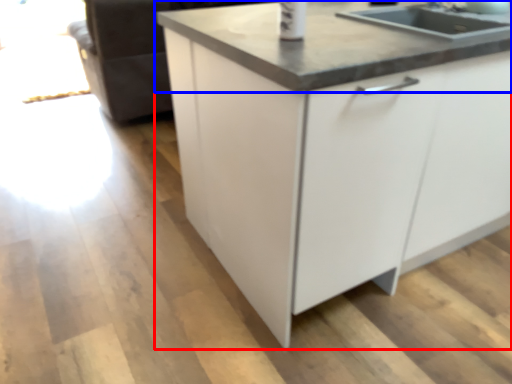
Question: Among these objects, which one is farthest to the camera, cabinetry (highlighted by a red box) or countertop (highlighted by a blue box)?

Choices:
 (A) cabinetry
 (B) countertop

Answer: (B)